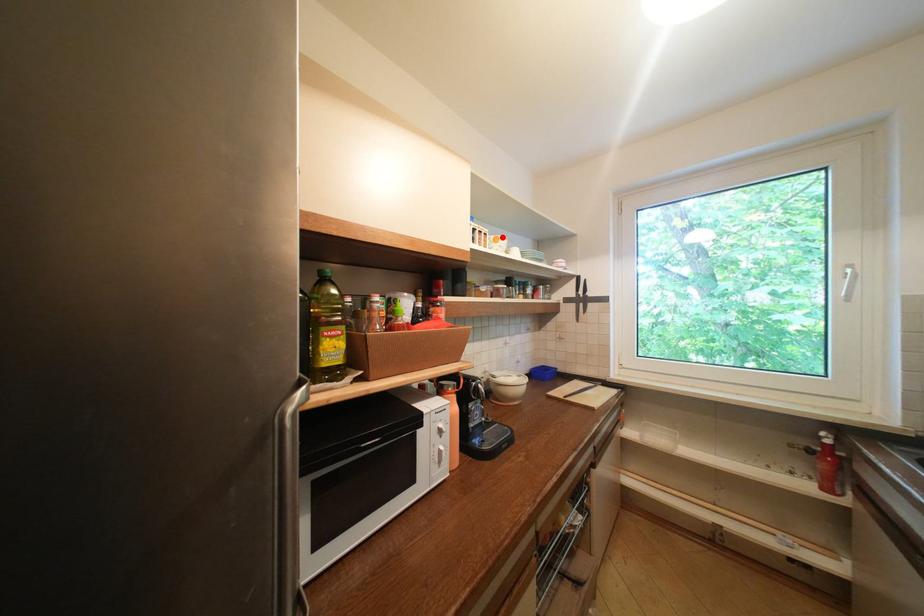
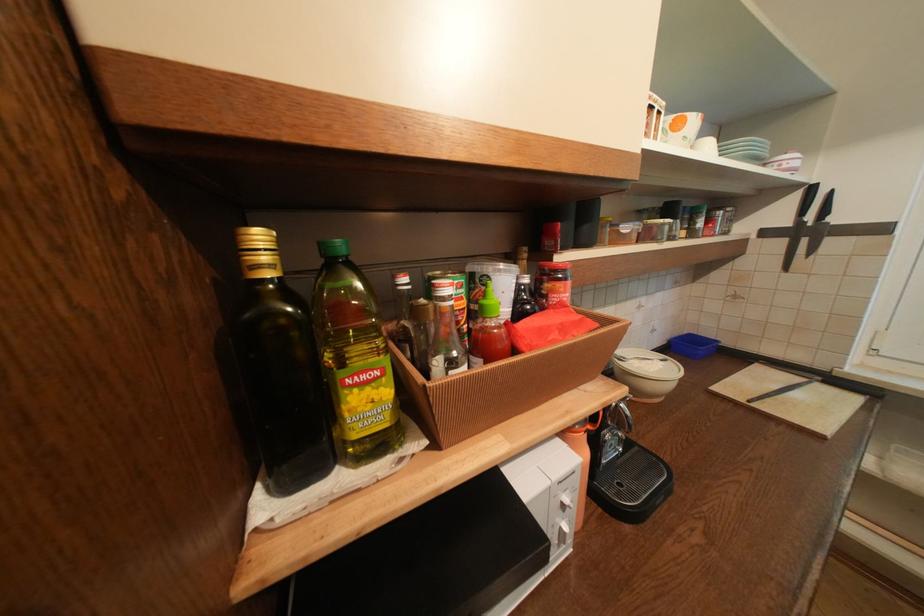
In the second image, find the point that corresponds to the highlighted location in the first image.

(683, 118)